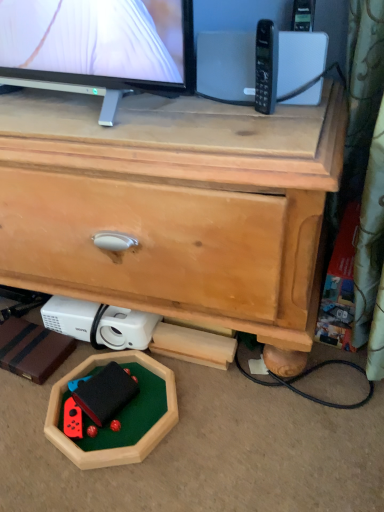
This screenshot has width=384, height=512. In order to click on spots to the right of black plastic phone at upper right in this screenshot , I will do `click(307, 112)`.